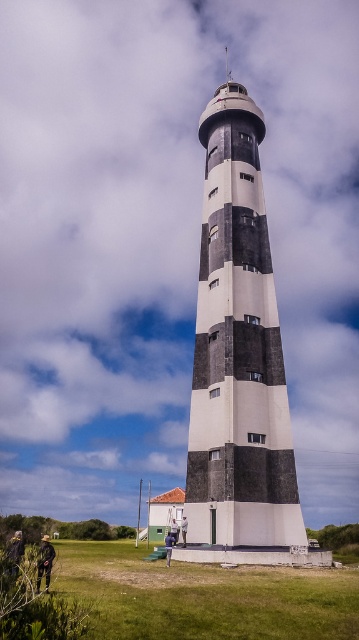
You are standing at the edge of the grassy area and want to walk directly to the lighthouse. Since you can see both the black and white striped lighthouse at center and the green grass at lower center, which object will you step on first?

The green grass at lower center is under the black and white striped lighthouse at center, so you will step on the green grass at lower center first before reaching the lighthouse.

You are standing at the center of the image and want to walk towards the black and white striped lighthouse at center. In which direction should you move relative to your current position?

Since the black and white striped lighthouse at center is located at point [239,355], you should move towards the center of the image to reach it.

You are a visitor standing at the base of the black and white striped lighthouse at center and looking towards the green grass at lower center. Which object appears taller from your perspective?

The green grass at lower center appears taller because the black and white striped lighthouse at center is smaller in size compared to it.